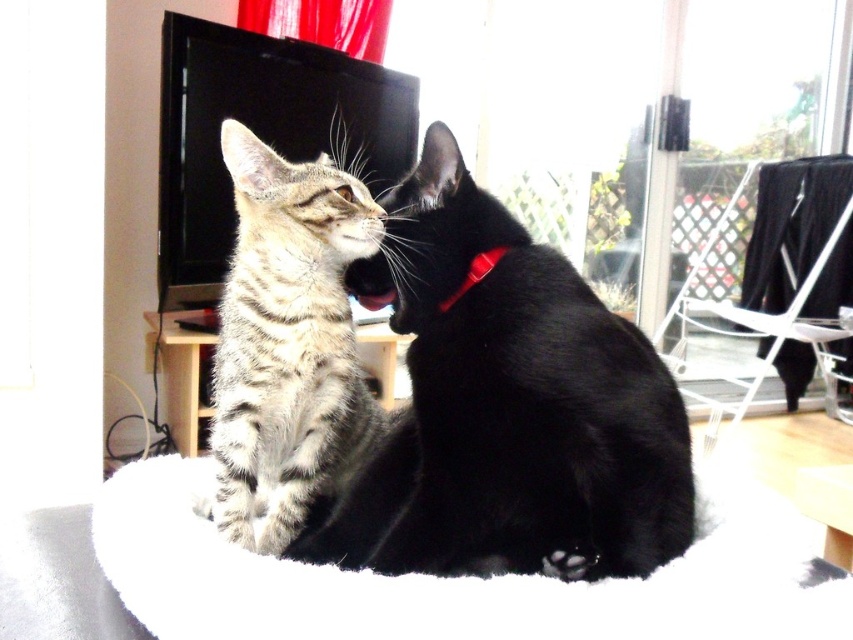
Question: Which is farther from the striped fur cat at center?

Choices:
 (A) tabby fur cat at center
 (B) red plastic neckband at center

Answer: (B)

Question: Among these points, which one is nearest to the camera?

Choices:
 (A) (438, 305)
 (B) (496, 237)
 (C) (331, 317)

Answer: (A)

Question: In this image, where is white fluffy cat bed at center located relative to red plastic neckband at center?

Choices:
 (A) left
 (B) right

Answer: (A)

Question: Estimate the real-world distances between objects in this image. Which object is closer to the tabby fur cat at center?

Choices:
 (A) white fluffy cat bed at center
 (B) red plastic neckband at center

Answer: (B)

Question: Is tabby fur cat at center below white fluffy cat bed at center?

Choices:
 (A) no
 (B) yes

Answer: (A)

Question: Can you confirm if tabby fur cat at center is positioned to the right of red plastic neckband at center?

Choices:
 (A) no
 (B) yes

Answer: (B)